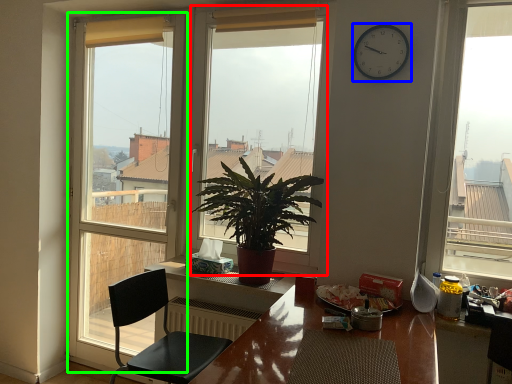
Question: Which is nearer to the window (highlighted by a red box)? clock (highlighted by a blue box) or window (highlighted by a green box).

Choices:
 (A) clock
 (B) window

Answer: (B)